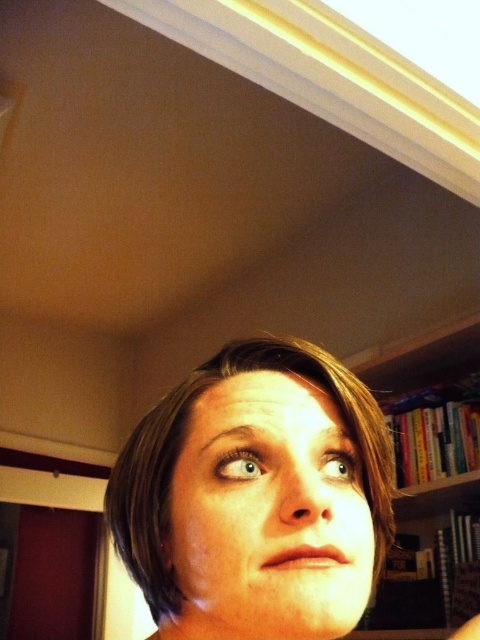
Consider the image. You are taking a photo of the person in the scene and want to focus on the point closer to the camera. Which point should you choose between point (320, 403) and point (388, 385)?

Point (320, 403) is closer to the camera than point (388, 385), so you should choose point (320, 403) to focus on.

Based on the scene description, which object takes up more space in the image, the smooth skin face at center or the hardcover books at right?

The hardcover books at right take up more space in the image than the smooth skin face at center, as the smooth skin face at center occupies less space than hardcover books at right.